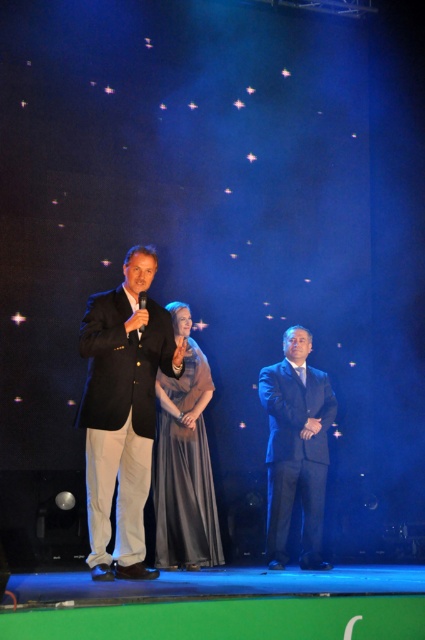
Question: Which point is closer to the camera taking this photo?

Choices:
 (A) (325, 410)
 (B) (167, 403)

Answer: (B)

Question: Which of these objects is positioned closest to the dark blue suit at center?

Choices:
 (A) shiny black suit at center
 (B) satin silver dress at center
 (C) matte black suit at center

Answer: (A)

Question: Can you confirm if satin silver dress at center is positioned below dark blue suit at center?

Choices:
 (A) no
 (B) yes

Answer: (A)

Question: Based on their relative distances, which object is nearer to the matte black suit at center?

Choices:
 (A) satin silver dress at center
 (B) shiny black suit at center

Answer: (A)

Question: Is satin silver dress at center thinner than shiny black suit at center?

Choices:
 (A) yes
 (B) no

Answer: (A)

Question: Can you confirm if dark blue suit at center is positioned to the left of shiny black suit at center?

Choices:
 (A) no
 (B) yes

Answer: (A)